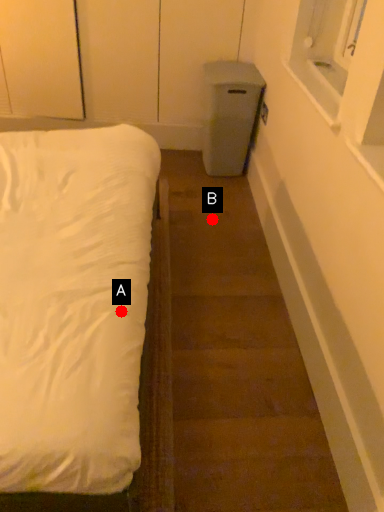
Question: Two points are circled on the image, labeled by A and B beside each circle. Which point is farther to the camera?

Choices:
 (A) A is further
 (B) B is further

Answer: (B)